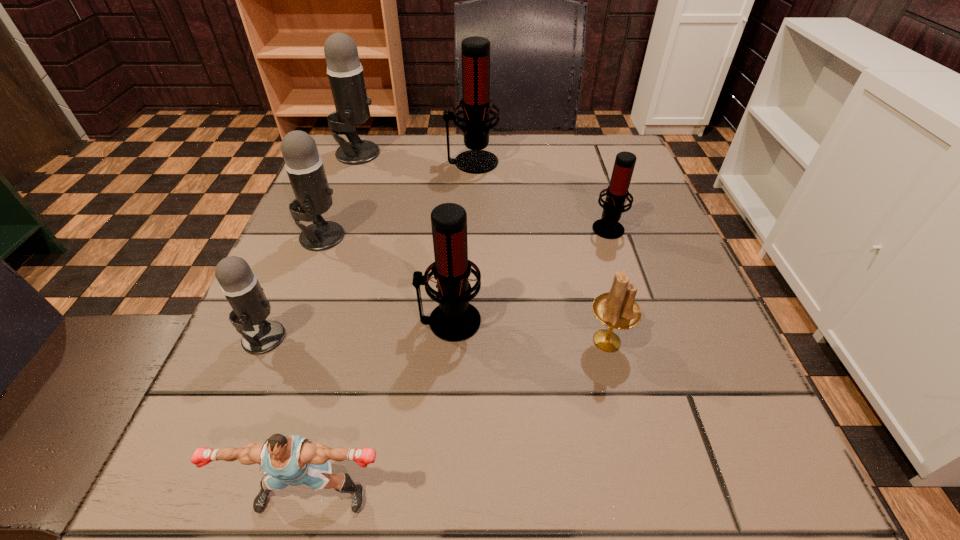
Where is `vacant area located on the right of the biggest gray microphone`? This screenshot has height=540, width=960. vacant area located on the right of the biggest gray microphone is located at coordinates (498, 153).

Where is `vacant area located on the front of the biggest red microphone`? The width and height of the screenshot is (960, 540). vacant area located on the front of the biggest red microphone is located at coordinates (469, 264).

Where is `free space located on the back of the second nearest gray microphone`? Image resolution: width=960 pixels, height=540 pixels. free space located on the back of the second nearest gray microphone is located at coordinates (348, 171).

This screenshot has width=960, height=540. What are the coordinates of `free spot located 0.130m on the back of the nearest red microphone` in the screenshot? It's located at (454, 250).

The height and width of the screenshot is (540, 960). Identify the location of free location located 0.380m on the left of the rightmost microphone. (400, 227).

I want to click on free space located 0.200m on the right of the nearest gray microphone, so click(x=414, y=337).

Locate an element on the screen. The height and width of the screenshot is (540, 960). vacant space located on the back of the candle holder is located at coordinates (587, 259).

At what (x,y) coordinates should I click in order to perform the action: click on object that is positioned at the near edge. Please return your answer as a coordinate pair (x, y). The height and width of the screenshot is (540, 960). Looking at the image, I should click on (293, 460).

This screenshot has width=960, height=540. I want to click on puncher that is at the left edge, so click(x=293, y=460).

Image resolution: width=960 pixels, height=540 pixels. I want to click on microphone that is positioned at the right edge, so click(608, 227).